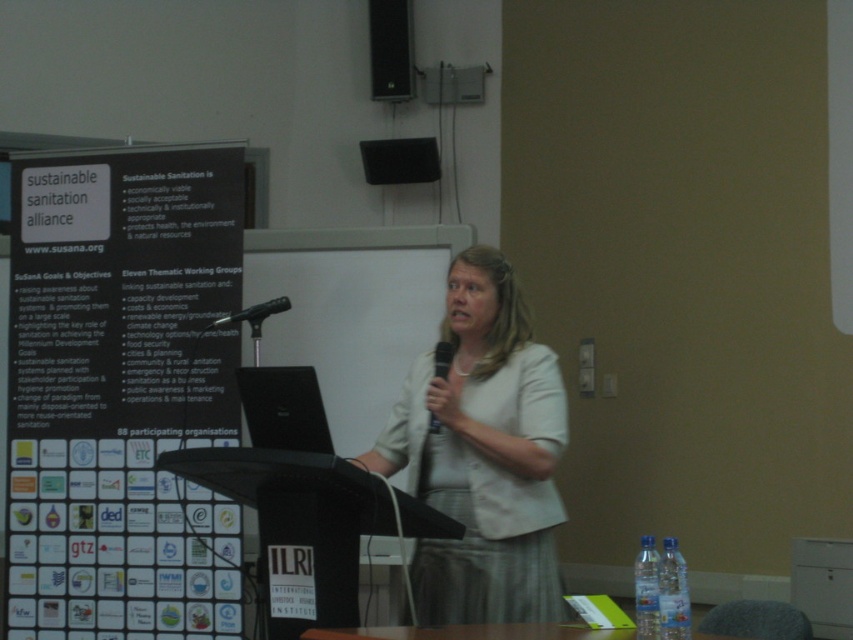
You are an attendee at the presentation and want to take notes on the Sustainable Sanitation Alliance poster. You have a pen in your right hand and notice the white paper at left and the black plastic microphone at center. Which object should you reach for to write on?

You should reach for the white paper at left to write on since it is closer to your right hand than the black plastic microphone at center.